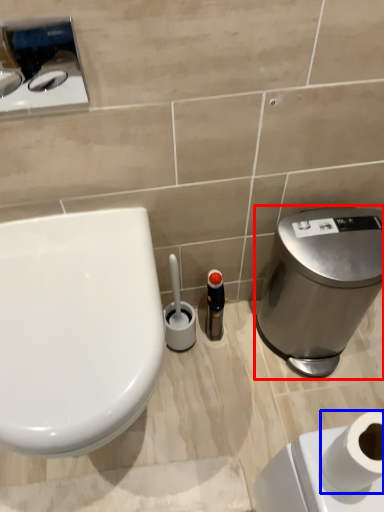
Question: Which point is closer to the camera, water cooler (highlighted by a red box) or toilet paper (highlighted by a blue box)?

Choices:
 (A) water cooler
 (B) toilet paper

Answer: (B)